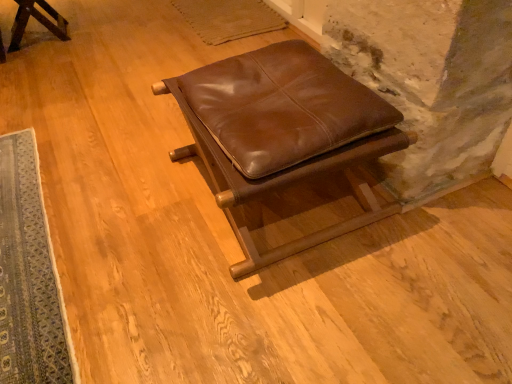
Where is `vacant space behind blue woven rug at lower left`? vacant space behind blue woven rug at lower left is located at coordinates (91, 119).